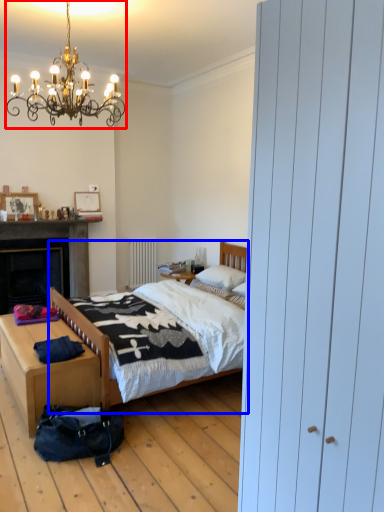
Question: Among these objects, which one is farthest to the camera, light fixture (highlighted by a red box) or bed (highlighted by a blue box)?

Choices:
 (A) light fixture
 (B) bed

Answer: (B)